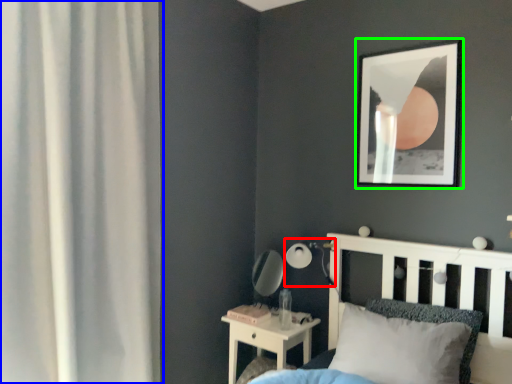
Question: Which object is positioned farthest from table lamp (highlighted by a red box)? Select from curtain (highlighted by a blue box) and picture frame (highlighted by a green box).

Choices:
 (A) curtain
 (B) picture frame

Answer: (A)